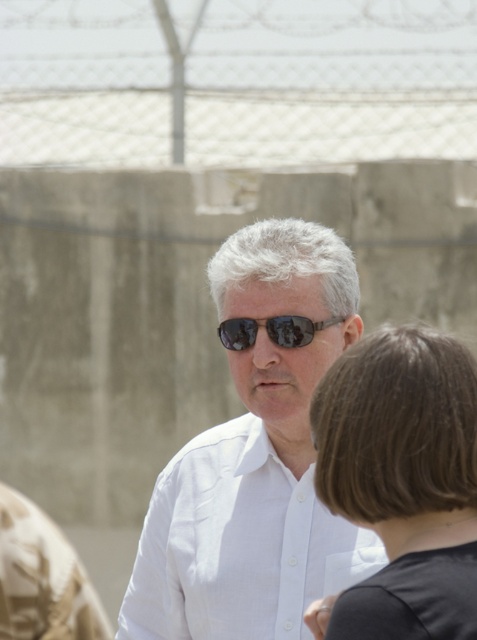
Who is shorter, metallic chain-link fence at upper center or black reflective sunglasses at center?

black reflective sunglasses at center

Does point (76, 61) come farther from viewer compared to point (309, 324)?

That is True.

Locate an element on the screen. The width and height of the screenshot is (477, 640). metallic chain-link fence at upper center is located at coordinates (236, 83).

Which of these two, metallic chain-link fence at upper center or white matte shirt at center, stands shorter?

metallic chain-link fence at upper center is shorter.

Which is in front, point (217, 8) or point (328, 296)?

Positioned in front is point (328, 296).

Where is `metallic chain-link fence at upper center`? The image size is (477, 640). metallic chain-link fence at upper center is located at coordinates (236, 83).

Which is more to the right, black matte hair at center or black reflective sunglasses at center?

From the viewer's perspective, black matte hair at center appears more on the right side.

Can you confirm if black matte hair at center is smaller than black reflective sunglasses at center?

Actually, black matte hair at center might be larger than black reflective sunglasses at center.

Identify the location of black matte hair at center. (402, 477).